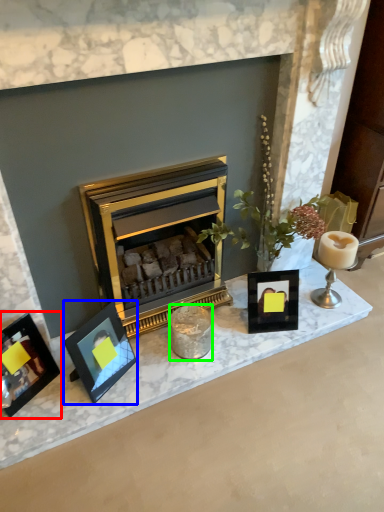
Question: Which object is positioned farthest from picture frame (highlighted by a red box)? Select from picture frame (highlighted by a blue box) and candle holder (highlighted by a green box).

Choices:
 (A) picture frame
 (B) candle holder

Answer: (B)